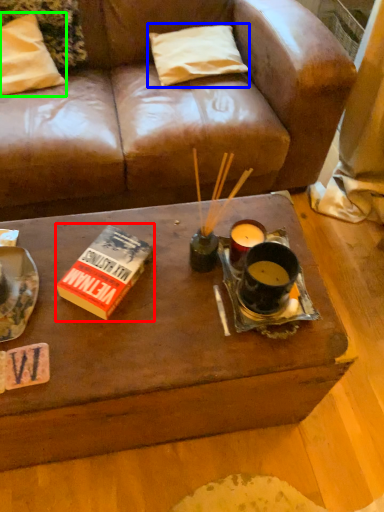
Question: Which is nearer to the paperback book (highlighted by a red box)? pillow (highlighted by a blue box) or pillow (highlighted by a green box).

Choices:
 (A) pillow
 (B) pillow

Answer: (B)